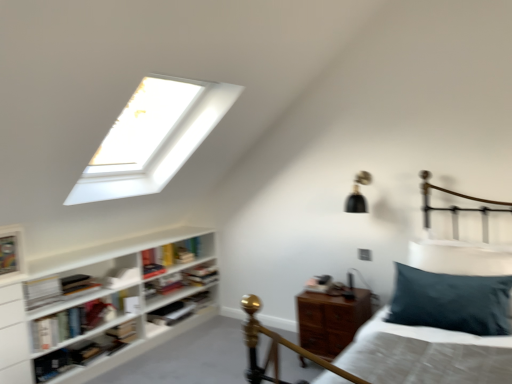
Where is `hardcover book at left, arranged as the 7th book when viewed from the back`? This screenshot has width=512, height=384. hardcover book at left, arranged as the 7th book when viewed from the back is located at coordinates (x=77, y=284).

This screenshot has width=512, height=384. What do you see at coordinates (77, 284) in the screenshot?
I see `hardcover book at left, the second book positioned from the front` at bounding box center [77, 284].

The width and height of the screenshot is (512, 384). In order to click on black matte lampshade at upper right in this screenshot , I will do `click(358, 194)`.

Locate an element on the screen. white wooden shelf at left is located at coordinates (98, 305).

Find the location of `hardcover book at center, which is counted as the seventh book, starting from the front`. hardcover book at center, which is counted as the seventh book, starting from the front is located at coordinates (164, 284).

What is the approximate width of white matte bookshelf at lower left, the sixth book viewed from the back?

It is 5.85 inches.

In order to face teal velvet pillow at right, should I rotate leftwards or rightwards?

A 23.525 degree turn to the right will do.

The height and width of the screenshot is (384, 512). I want to click on hardcover book at center, the 1th book positioned from the back, so point(200,274).

Which object is further away from the camera, hardcover book at lower left, the fifth book in the back-to-front sequence, or white matte bookshelf at lower left, which is the 3th book in front-to-back order?

hardcover book at lower left, the fifth book in the back-to-front sequence, is behind.

Which is correct: hardcover book at lower left, the fifth book in the back-to-front sequence, is inside white matte bookshelf at lower left, which is the 3th book in front-to-back order, or outside of it?

hardcover book at lower left, the fifth book in the back-to-front sequence, lies outside white matte bookshelf at lower left, which is the 3th book in front-to-back order.

In the scene shown: Is hardcover book at lower left, the fifth book in the back-to-front sequence, next to white matte bookshelf at lower left, which is the 3th book in front-to-back order, and touching it?

No, hardcover book at lower left, the fifth book in the back-to-front sequence, is not next to white matte bookshelf at lower left, which is the 3th book in front-to-back order.

Could you tell me if white wooden shelf at left is facing hardcover book at center, the third book from the back?

Yes, white wooden shelf at left is oriented towards hardcover book at center, the third book from the back.

Can you tell me how much white wooden shelf at left and hardcover book at center, which is counted as the 6th book, starting from the front, differ in facing direction?

There is a 0.258-degree angle between the facing directions of white wooden shelf at left and hardcover book at center, which is counted as the 6th book, starting from the front.

Locate an element on the screen. shelf above the hardcover book at center, the third book from the back (from a real-world perspective) is located at coordinates (98, 305).

Considering the sizes of objects white wooden shelf at left and hardcover book at center, the third book from the back, in the image provided, who is shorter, white wooden shelf at left or hardcover book at center, the third book from the back,?

With less height is hardcover book at center, the third book from the back.

Is white matte bookshelf at lower left, the sixth book viewed from the back, behind hardcover book at center, arranged as the 2th book when viewed from the back?

No, it is in front of hardcover book at center, arranged as the 2th book when viewed from the back.

Is white matte bookshelf at lower left, which is the 3th book in front-to-back order, far away from hardcover book at center, which is counted as the seventh book, starting from the front?

They are positioned close to each other.

Is teal velvet pillow at right inside the boundaries of white matte bookshelf at lower left, the sixth book viewed from the back, or outside?

The correct answer is: outside.

From their relative heights in the image, would you say teal velvet pillow at right is taller or shorter than white matte bookshelf at lower left, the sixth book viewed from the back?

Clearly, teal velvet pillow at right is taller compared to white matte bookshelf at lower left, the sixth book viewed from the back.

From the image's perspective, which is below, teal velvet pillow at right or white matte bookshelf at lower left, the sixth book viewed from the back?

white matte bookshelf at lower left, the sixth book viewed from the back, appears lower in the image.

Can you tell me how much teal velvet pillow at right and white matte bookshelf at lower left, which is the 3th book in front-to-back order, differ in facing direction?

The facing directions of teal velvet pillow at right and white matte bookshelf at lower left, which is the 3th book in front-to-back order, are 96.4 degrees apart.

Is white matte bookshelf at lower left, the sixth book viewed from the back, facing towards black matte lampshade at upper right?

No, white matte bookshelf at lower left, the sixth book viewed from the back, does not turn towards black matte lampshade at upper right.

Can you tell me how much white matte bookshelf at lower left, the sixth book viewed from the back, and black matte lampshade at upper right differ in facing direction?

white matte bookshelf at lower left, the sixth book viewed from the back, and black matte lampshade at upper right are facing 90.1 degrees away from each other.

Is white matte bookshelf at lower left, which is the 3th book in front-to-back order, not close to black matte lampshade at upper right?

That's right, there is a large distance between white matte bookshelf at lower left, which is the 3th book in front-to-back order, and black matte lampshade at upper right.

Can you confirm if white matte bookshelf at lower left, the sixth book viewed from the back, is taller than black matte lampshade at upper right?

In fact, white matte bookshelf at lower left, the sixth book viewed from the back, may be shorter than black matte lampshade at upper right.

From a real-world perspective, is white wooden shelf at left located higher than wooden nightstand at lower right?

Indeed, from a real-world perspective, white wooden shelf at left stands above wooden nightstand at lower right.

Who is smaller, white wooden shelf at left or wooden nightstand at lower right?

Smaller between the two is wooden nightstand at lower right.

Is white wooden shelf at left placed right next to wooden nightstand at lower right?

No, white wooden shelf at left is not in contact with wooden nightstand at lower right.

Is point (1, 358) less distant than point (338, 319)?

Yes.

Considering the relative sizes of hardcover book at lower left, the fifth book in the back-to-front sequence, and hardcover book at left, which ranks as the first book in front-to-back order, in the image provided, is hardcover book at lower left, the fifth book in the back-to-front sequence, taller than hardcover book at left, which ranks as the first book in front-to-back order,?

Correct, hardcover book at lower left, the fifth book in the back-to-front sequence, is much taller as hardcover book at left, which ranks as the first book in front-to-back order.

What's the angular difference between hardcover book at lower left, the fifth book in the back-to-front sequence, and hardcover book at left, which ranks as the first book in front-to-back order,'s facing directions?

1.91 degrees.

Is hardcover book at lower left, which is the 4th book from front to back, smaller than hardcover book at left, which ranks as the first book in front-to-back order?

Indeed, hardcover book at lower left, which is the 4th book from front to back, has a smaller size compared to hardcover book at left, which ranks as the first book in front-to-back order.

Is hardcover book at lower left, which is the 4th book from front to back, positioned behind hardcover book at left, placed as the eighth book when sorted from back to front?

Yes.

Identify the location of the 1st book in front of the hardcover book at lower left, the fifth book in the back-to-front sequence. The image size is (512, 384). (122, 278).

From the image's perspective, which book is the 1st one below the white wooden shelf at left? Please provide its 2D coordinates.

[(172, 313)]

When comparing their distances from hardcover book at center, which is counted as the 6th book, starting from the front, does white matte bookshelf at lower left, the sixth book viewed from the back, or hardcover book at center, which is counted as the seventh book, starting from the front, seem closer?

Based on the image, hardcover book at center, which is counted as the seventh book, starting from the front, appears to be nearer to hardcover book at center, which is counted as the 6th book, starting from the front.

In the scene shown: When comparing their distances from hardcover book at center-left, which appears as the 4th book when viewed from the back, does hardcover book at center, the 1th book positioned from the back, or black matte lampshade at upper right seem further?

black matte lampshade at upper right is positioned further to the anchor hardcover book at center-left, which appears as the 4th book when viewed from the back.

Looking at the image, which one is located further to hardcover book at left, arranged as the 7th book when viewed from the back, hardcover book at center, the third book from the back, or wooden nightstand at lower right?

wooden nightstand at lower right.

Estimate the real-world distances between objects in this image. Which object is closer to teal velvet pillow at right, hardcover book at center, placed as the 8th book when sorted from front to back, or wooden nightstand at lower right?

wooden nightstand at lower right is positioned closer to the anchor teal velvet pillow at right.

Based on their spatial positions, is white wooden shelf at left or white matte bookshelf at lower left, the sixth book viewed from the back, further from hardcover book at lower left, which is the 4th book from front to back?

white wooden shelf at left lies further to hardcover book at lower left, which is the 4th book from front to back, than the other object.

From the picture: Which object lies further to the anchor point hardcover book at lower left, which is the 4th book from front to back, wooden nightstand at lower right or hardcover book at center, which is counted as the seventh book, starting from the front?

wooden nightstand at lower right is further to hardcover book at lower left, which is the 4th book from front to back.

Looking at this image, which object lies nearer to the anchor point white matte bookshelf at lower left, the sixth book viewed from the back, teal velvet pillow at right or white wooden shelf at left?

Based on the image, white wooden shelf at left appears to be nearer to white matte bookshelf at lower left, the sixth book viewed from the back.

Based on their spatial positions, is white wooden shelf at left or white matte bookshelf at lower left, which is the 3th book in front-to-back order, closer to hardcover book at left, which ranks as the first book in front-to-back order?

white matte bookshelf at lower left, which is the 3th book in front-to-back order, lies closer to hardcover book at left, which ranks as the first book in front-to-back order, than the other object.

What are the coordinates of `book situated between hardcover book at center, the third book from the back, and wooden nightstand at lower right from left to right` in the screenshot? It's located at (200, 274).

This screenshot has width=512, height=384. Find the location of `light fixture between teal velvet pillow at right and hardcover book at center, the 1th book positioned from the back, along the z-axis`. light fixture between teal velvet pillow at right and hardcover book at center, the 1th book positioned from the back, along the z-axis is located at coordinates (358, 194).

Where is `light fixture situated between hardcover book at center-left, which ranks as the fifth book in front-to-back order, and teal velvet pillow at right from left to right`? light fixture situated between hardcover book at center-left, which ranks as the fifth book in front-to-back order, and teal velvet pillow at right from left to right is located at coordinates (358, 194).

Locate an element on the screen. The width and height of the screenshot is (512, 384). nightstand between white wooden shelf at left and teal velvet pillow at right from left to right is located at coordinates (331, 320).